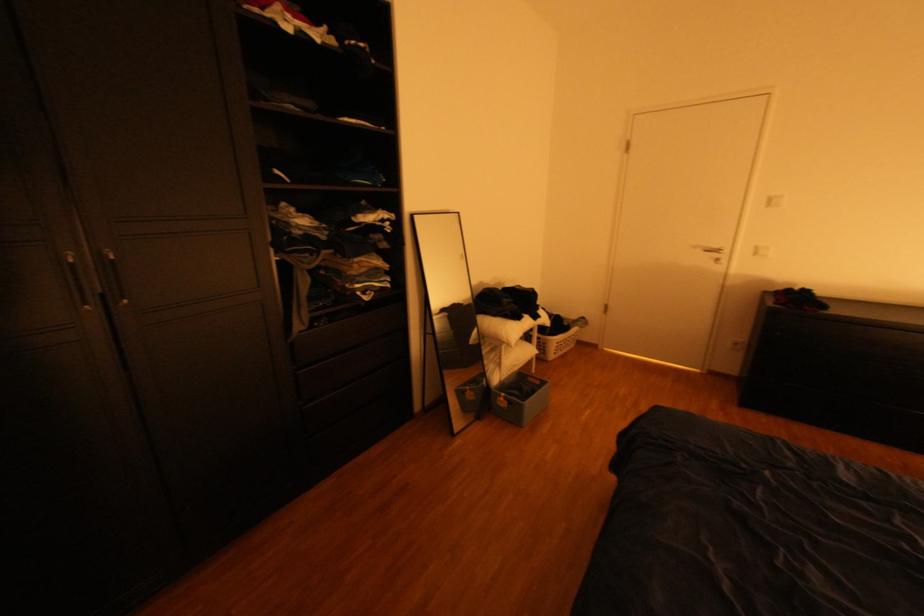
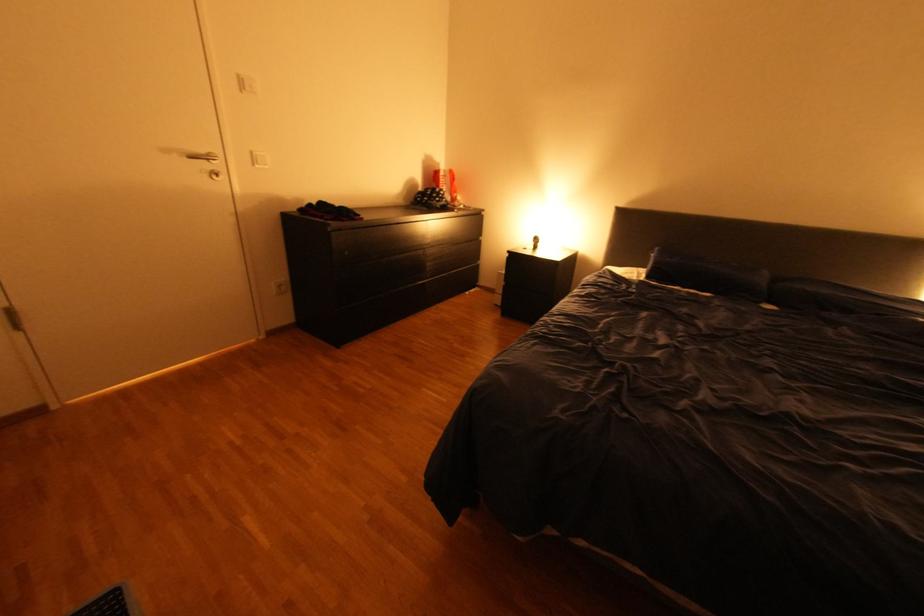
In the second image, find the point that corresponds to pixel 725 246 in the first image.

(213, 151)